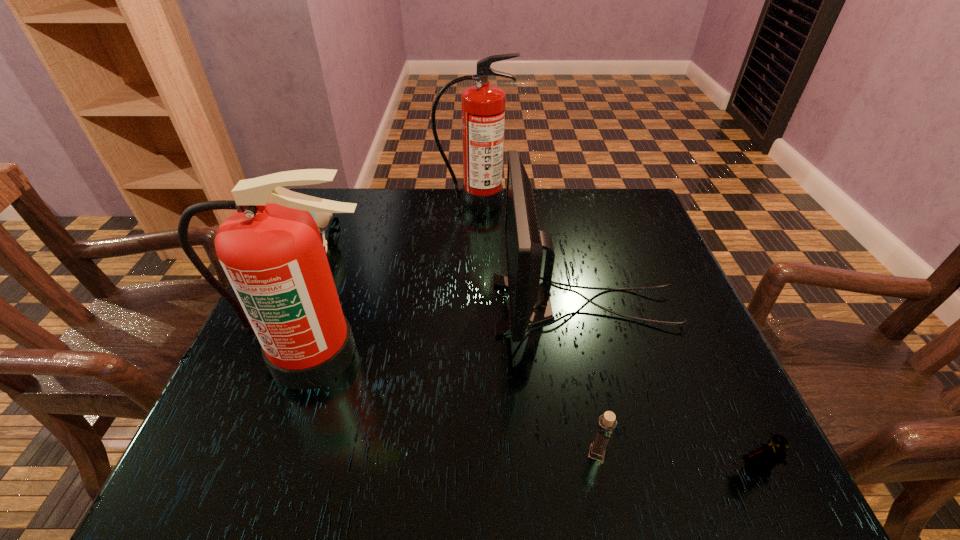
I want to click on vacant region at the far right corner, so click(636, 226).

Find the location of `unoccupied area between the candle holder and the right fire extinguisher`. unoccupied area between the candle holder and the right fire extinguisher is located at coordinates (536, 328).

Locate an element on the screen. This screenshot has width=960, height=540. unoccupied position between the shortest object and the left fire extinguisher is located at coordinates (535, 412).

Find the location of a particular element. This screenshot has height=540, width=960. vacant region between the fifth tallest object and the farther fire extinguisher is located at coordinates (536, 328).

Identify the location of vacant space that's between the farther fire extinguisher and the bird. (399, 221).

What are the coordinates of `vacant region between the candle holder and the fourth tallest object` in the screenshot? It's located at (460, 347).

Where is `unoccupied area between the computer monitor and the shortest object`? This screenshot has width=960, height=540. unoccupied area between the computer monitor and the shortest object is located at coordinates (670, 388).

The height and width of the screenshot is (540, 960). Identify the location of free point between the shortest object and the nearer fire extinguisher. (535, 412).

Find the location of a particular element. free space between the nearer fire extinguisher and the farther fire extinguisher is located at coordinates (395, 279).

Image resolution: width=960 pixels, height=540 pixels. Find the location of `object that is the fourth closest to the computer monitor`. object that is the fourth closest to the computer monitor is located at coordinates (271, 250).